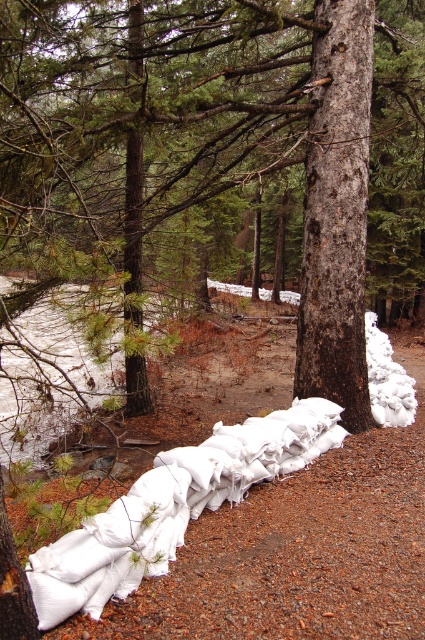
Does smooth brown bark at center have a greater height compared to white fabric sandbags at lower center?

Yes.

Is smooth brown bark at center to the left of white fabric sandbags at lower center from the viewer's perspective?

No, smooth brown bark at center is not to the left of white fabric sandbags at lower center.

You are a GUI agent. You are given a task and a screenshot of the screen. Output one action in this format:
    pyautogui.click(x=<x>, y=<y>)
    Task: Click on the smooth brown bark at center
    The width and height of the screenshot is (425, 640).
    Given the screenshot: What is the action you would take?
    pyautogui.click(x=337, y=211)

Find the location of a particular element. The width and height of the screenshot is (425, 640). smooth brown bark at center is located at coordinates (337, 211).

Which is above, brown rough tree at center or white fabric sandbags at lower center?

Positioned higher is brown rough tree at center.

The height and width of the screenshot is (640, 425). Describe the element at coordinates (212, 141) in the screenshot. I see `brown rough tree at center` at that location.

What do you see at coordinates (212, 141) in the screenshot? I see `brown rough tree at center` at bounding box center [212, 141].

Locate an element on the screen. brown rough tree at center is located at coordinates (212, 141).

Is brown rough tree at center positioned at the back of smooth brown bark at center?

That is False.

Between brown rough tree at center and smooth brown bark at center, which one is positioned lower?

smooth brown bark at center

Is point (76, 168) closer to camera compared to point (362, 227)?

That is True.

This screenshot has width=425, height=640. Identify the location of brown rough tree at center. (212, 141).